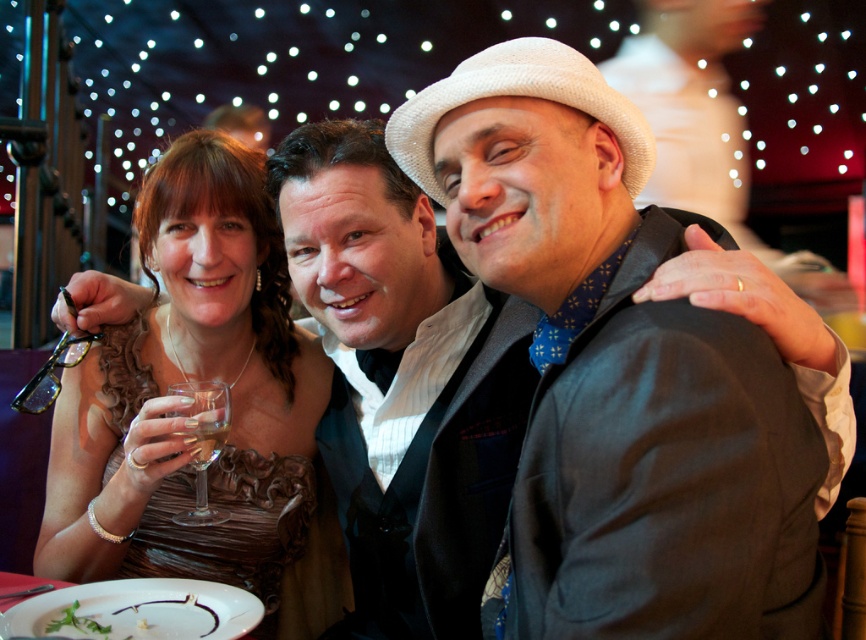
Question: Which of the following is the farthest from the observer?

Choices:
 (A) brown satin dress at left
 (B) clear glass wine glass at center
 (C) clear glass wine at center

Answer: (B)

Question: Which point is farther to the camera?

Choices:
 (A) (282, 609)
 (B) (152, 609)

Answer: (A)

Question: Does clear glass wine glass at center have a lesser width compared to clear glass wine at center?

Choices:
 (A) yes
 (B) no

Answer: (B)

Question: Considering the relative positions of matte black jacket at center and white creamy sauce at lower left in the image provided, where is matte black jacket at center located with respect to white creamy sauce at lower left?

Choices:
 (A) below
 (B) above

Answer: (B)

Question: Does brown satin dress at left have a greater width compared to clear glass wine glass at center?

Choices:
 (A) yes
 (B) no

Answer: (A)

Question: Among these objects, which one is farthest from the camera?

Choices:
 (A) white creamy sauce at lower left
 (B) matte black jacket at center

Answer: (A)